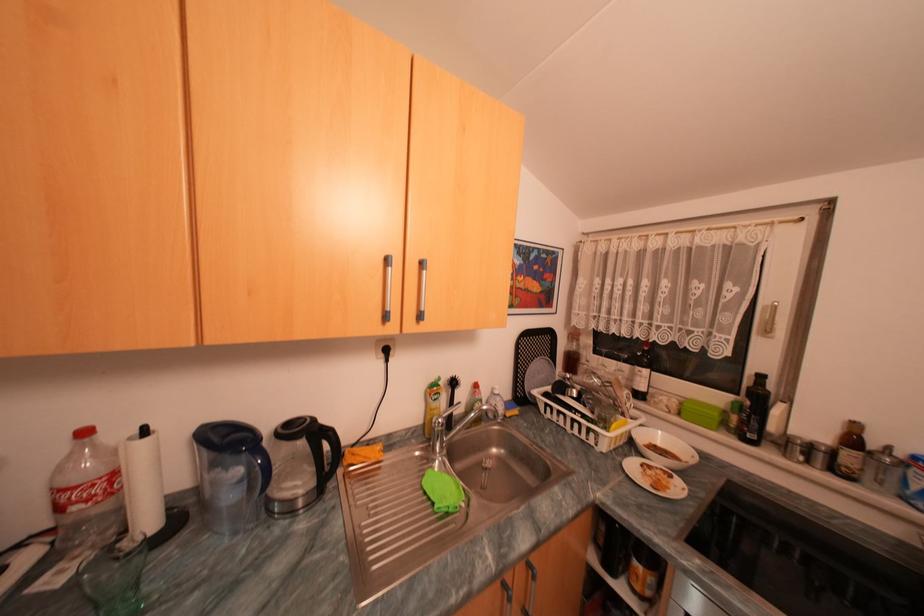
Where would you lift the silver faucet handle? Please return your answer as a coordinate pair (x, y).

(440, 440)